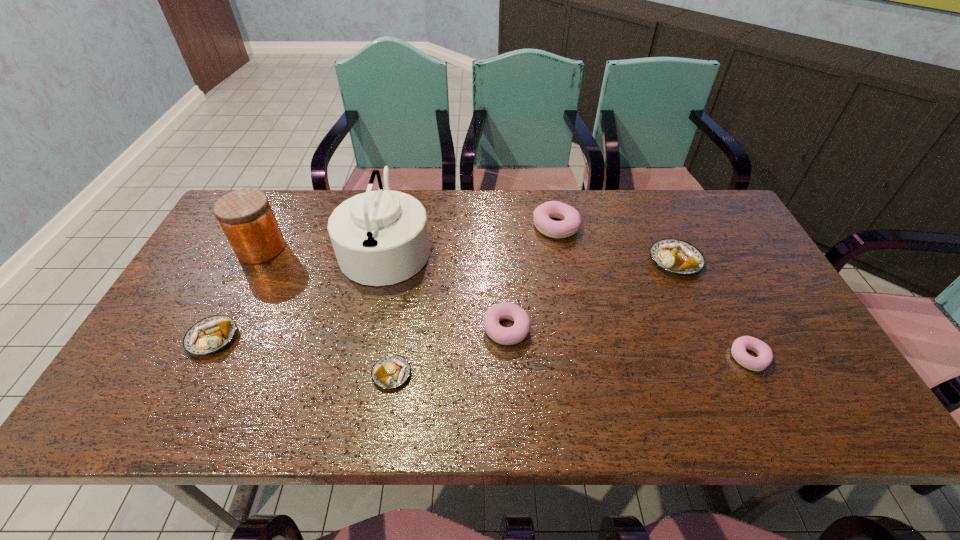
Identify the location of the leftmost pastry. (209, 335).

You are a GUI agent. You are given a task and a screenshot of the screen. Output one action in this format:
    pyautogui.click(x=<x>, y=<y>)
    Task: Click on the second smallest brown pastry
    This screenshot has height=540, width=960.
    Given the screenshot: What is the action you would take?
    209,335

Where is `the smallest pink pastry`? The height and width of the screenshot is (540, 960). the smallest pink pastry is located at coordinates pyautogui.click(x=765, y=355).

The image size is (960, 540). Find the location of `the second pastry from left to right`. the second pastry from left to right is located at coordinates (392, 371).

At what (x,y) coordinates should I click in order to perform the action: click on the second brown pastry from left to right. Please return your answer as a coordinate pair (x, y). Looking at the image, I should click on (392, 371).

Find the location of a particular element. This screenshot has width=960, height=540. vacant space located 0.290m on the spout of the kettle is located at coordinates (529, 246).

Identify the location of free space located on the front of the second tallest object. (190, 387).

Where is `blank area located on the left of the fourth pastry from left to right`? The height and width of the screenshot is (540, 960). blank area located on the left of the fourth pastry from left to right is located at coordinates (478, 227).

The image size is (960, 540). Find the location of `blank space located on the front of the farthest brown pastry`. blank space located on the front of the farthest brown pastry is located at coordinates (731, 387).

The image size is (960, 540). I want to click on blank space located on the left of the leftmost pink pastry, so [x=415, y=329].